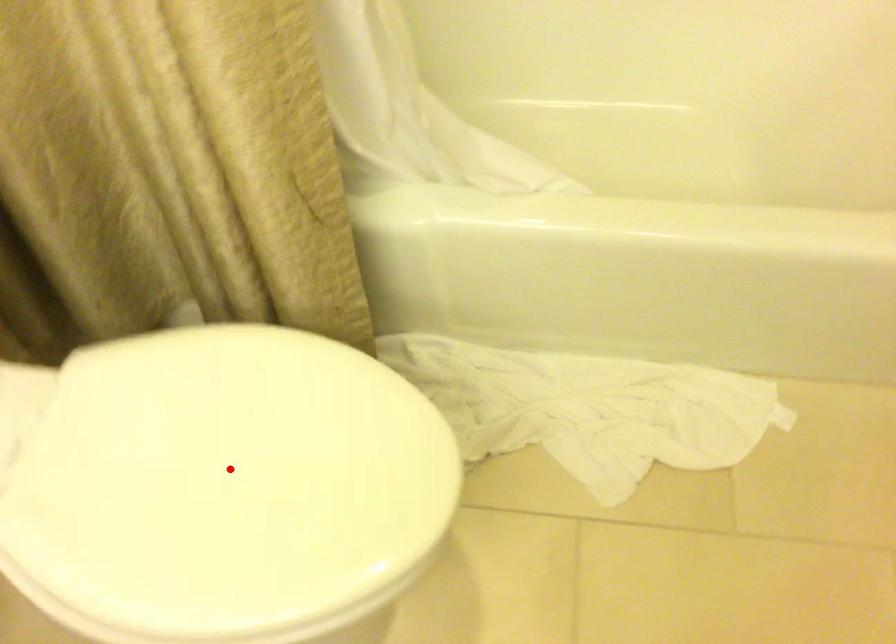
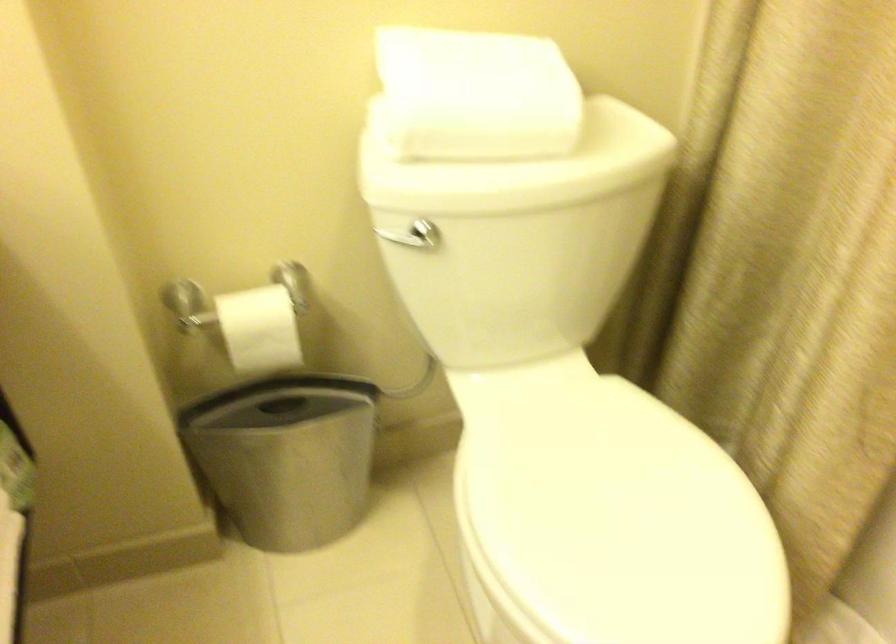
Question: I am providing you with two images of the same scene from different viewpoints. Given a red point in image1, look at the same physical point in image2. Is it:

Choices:
 (A) Closer to the viewpoint
 (B) Farther from the viewpoint

Answer: (B)